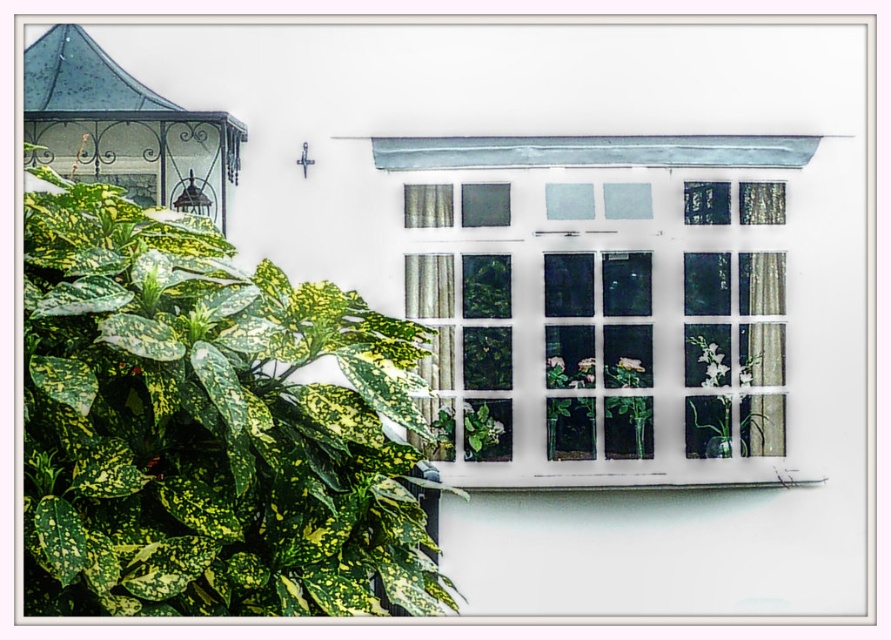
You are standing in front of the window and notice two plants. The green variegated leaf at left and the green glossy plant at center. Which one is higher up from the ground?

The green variegated leaf at left is above the green glossy plant at center, so it is higher up from the ground.

You are a gardener who needs to water both the green variegated leaf at left and the green glossy plant at center. Given that your watering can has a range of 8 feet, can you water both plants without moving closer? Please explain your reasoning based on their distance.

The green variegated leaf at left and the green glossy plant at center are 8.93 feet apart. Since the watering can has a range of only 8 feet, you cannot water both plants without moving closer because the distance between them exceeds the canister range.